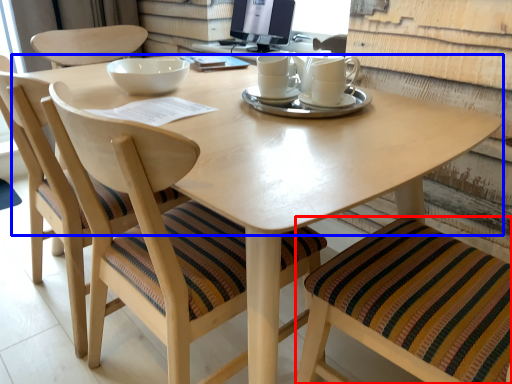
Question: Which of the following is the farthest to the observer, chair (highlighted by a red box) or round table (highlighted by a blue box)?

Choices:
 (A) chair
 (B) round table

Answer: (B)